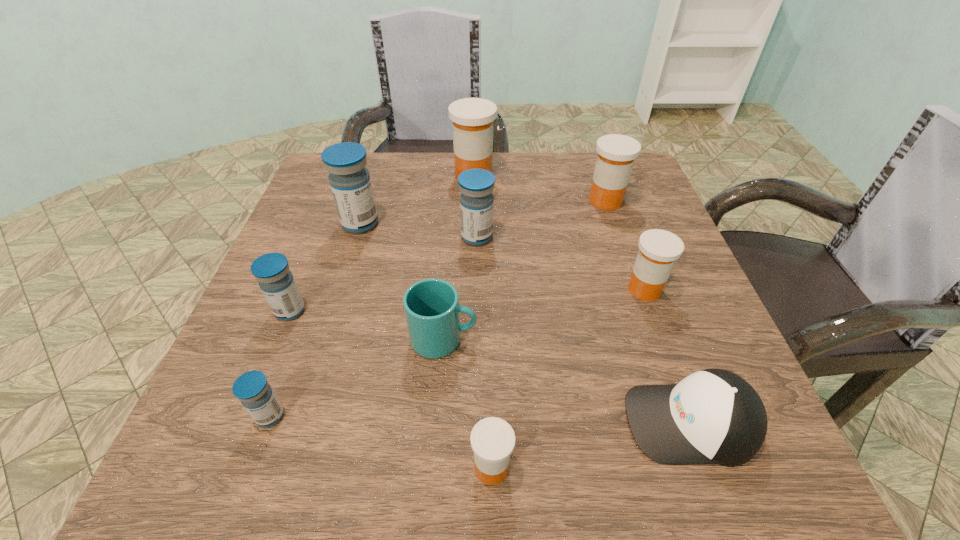
Where is `free space that is in between the farthest medicine and the gray cap`? The image size is (960, 540). free space that is in between the farthest medicine and the gray cap is located at coordinates (582, 299).

The height and width of the screenshot is (540, 960). Identify the location of empty space that is in between the third biggest orange medicine and the biggest blue medicine. (502, 256).

Where is `object that stands as the third closest to the cup`? This screenshot has width=960, height=540. object that stands as the third closest to the cup is located at coordinates (476, 186).

Identify the location of object that can be found as the seventh closest to the third biggest blue medicine. (713, 416).

Locate which medicine ranks third in proximity to the third nearest orange medicine. Please provide its 2D coordinates. Your answer should be formatted as a tuple, i.e. [(x, y)], where the tuple contains the x and y coordinates of a point satisfying the conditions above.

[(476, 186)]

Where is `medicine that is the sixth closest to the second biggest orange medicine`? The height and width of the screenshot is (540, 960). medicine that is the sixth closest to the second biggest orange medicine is located at coordinates (271, 270).

You are a GUI agent. You are given a task and a screenshot of the screen. Output one action in this format:
    pyautogui.click(x=<x>, y=<y>)
    Task: Click on the orange medicine that is the third closest to the biggest blue medicine
    Image resolution: width=960 pixels, height=540 pixels.
    Given the screenshot: What is the action you would take?
    pyautogui.click(x=492, y=439)

This screenshot has width=960, height=540. I want to click on the second closest orange medicine to the third nearest orange medicine, so click(x=472, y=118).

Point out which blue medicine is positioned as the second nearest to the third biggest blue medicine. Please provide its 2D coordinates. Your answer should be formatted as a tuple, i.e. [(x, y)], where the tuple contains the x and y coordinates of a point satisfying the conditions above.

[(349, 179)]

Locate which blue medicine ranks in proximity to the smallest orange medicine. Please provide its 2D coordinates. Your answer should be formatted as a tuple, i.e. [(x, y)], where the tuple contains the x and y coordinates of a point satisfying the conditions above.

[(252, 389)]